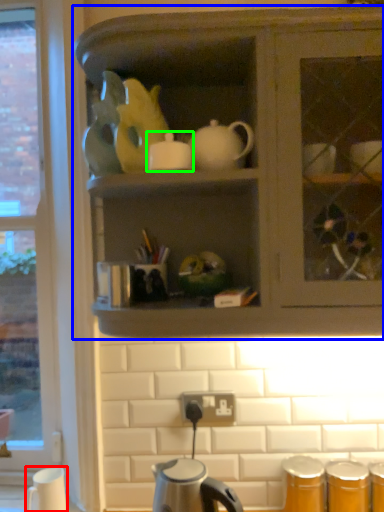
Question: Based on their relative distances, which object is nearer to coffee cup (highlighted by a red box)? Choose from cabinetry (highlighted by a blue box) and tableware (highlighted by a green box).

Choices:
 (A) cabinetry
 (B) tableware

Answer: (B)